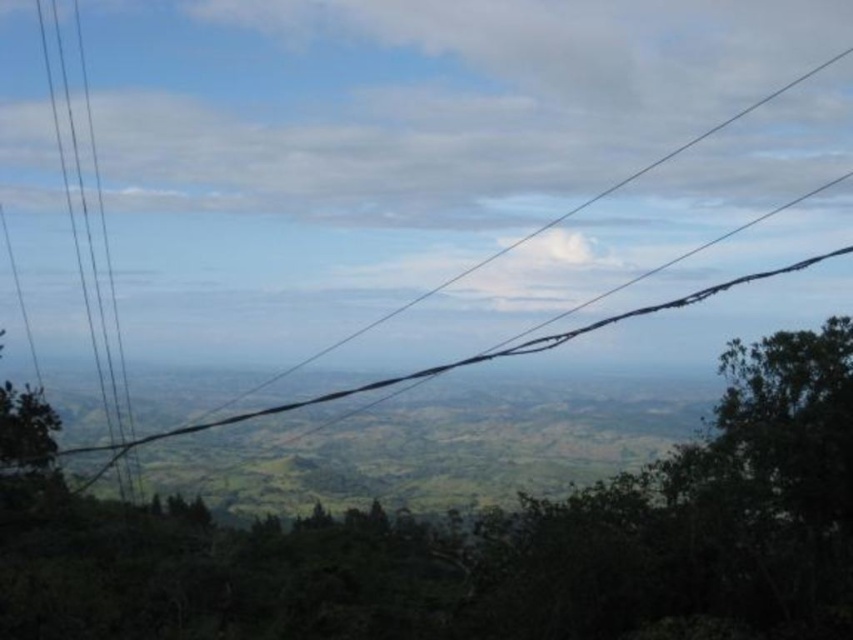
What do you see at coordinates (488, 541) in the screenshot? I see `green leafy tree at center` at bounding box center [488, 541].

Is green leafy tree at center wider than black wire at left?

Indeed, green leafy tree at center has a greater width compared to black wire at left.

Is point (822, 332) less distant than point (131, 488)?

Yes, point (822, 332) is closer to viewer.

Identify the location of green leafy tree at center. The image size is (853, 640). (488, 541).

Can you confirm if black wire at left is shorter than black wire at center?

Incorrect, black wire at left's height does not fall short of black wire at center's.

The width and height of the screenshot is (853, 640). I want to click on black wire at left, so click(86, 230).

Does point (80, 588) come behind point (711, 288)?

Yes, it is.

Can you confirm if green leafy tree at center is thinner than black wire at center?

Yes.

Locate an element on the screen. green leafy tree at center is located at coordinates tap(488, 541).

You are a GUI agent. You are given a task and a screenshot of the screen. Output one action in this format:
    pyautogui.click(x=<x>, y=<y>)
    Task: Click on the green leafy tree at center
    The width and height of the screenshot is (853, 640).
    Given the screenshot: What is the action you would take?
    pyautogui.click(x=488, y=541)